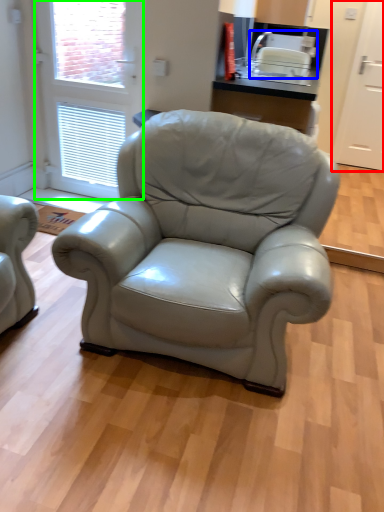
Question: Estimate the real-world distances between objects in this image. Which object is farther from screen door (highlighted by a red box), appliance (highlighted by a blue box) or screen door (highlighted by a green box)?

Choices:
 (A) appliance
 (B) screen door

Answer: (B)